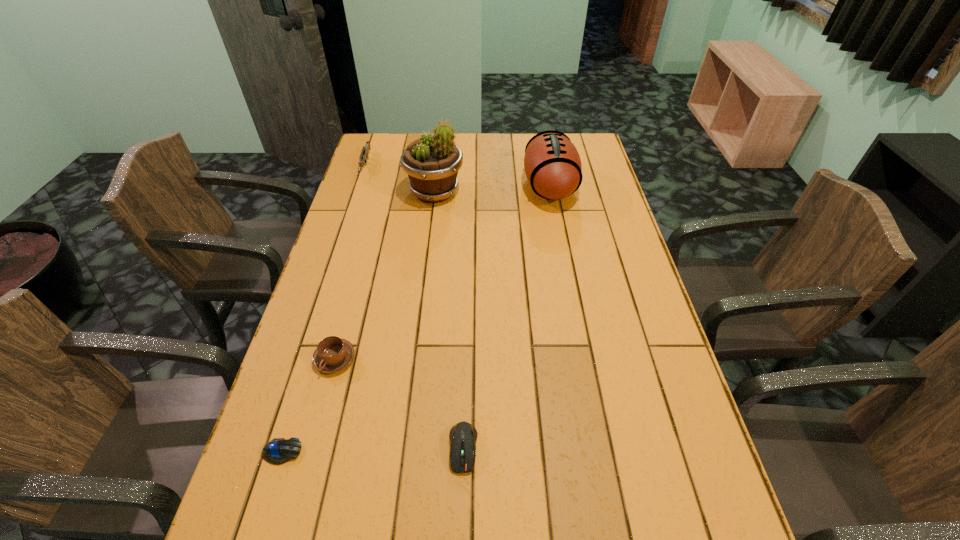
The image size is (960, 540). Find the location of `vacant space that's between the shorter computer mouse and the fourth shortest object`. vacant space that's between the shorter computer mouse and the fourth shortest object is located at coordinates (324, 309).

At what (x,y) coordinates should I click in order to perform the action: click on free spot between the shortest object and the taller computer mouse. Please return your answer as a coordinate pair (x, y). The width and height of the screenshot is (960, 540). Looking at the image, I should click on [x=372, y=450].

You are a GUI agent. You are given a task and a screenshot of the screen. Output one action in this format:
    pyautogui.click(x=<x>, y=<y>)
    Task: Click on the free spot between the shortest object and the third tallest object
    The image size is (960, 540).
    Given the screenshot: What is the action you would take?
    pyautogui.click(x=324, y=309)

Where is `empty space that is in between the right computer mouse and the gun`? The width and height of the screenshot is (960, 540). empty space that is in between the right computer mouse and the gun is located at coordinates (414, 307).

Image resolution: width=960 pixels, height=540 pixels. I want to click on vacant area between the right computer mouse and the rightmost object, so click(x=506, y=317).

Find the location of a particular element. The image size is (960, 540). vacant area between the right computer mouse and the fourth shortest object is located at coordinates (414, 307).

Identify the location of free point between the gun and the third nearest object. (350, 262).

You are a GUI agent. You are given a task and a screenshot of the screen. Output one action in this format:
    pyautogui.click(x=<x>, y=<y>)
    Task: Click on the vacant area between the fourth tallest object and the rightmost object
    This screenshot has width=960, height=540.
    Given the screenshot: What is the action you would take?
    pyautogui.click(x=443, y=273)

Where is `object identified as the fourth closest to the gun`? The height and width of the screenshot is (540, 960). object identified as the fourth closest to the gun is located at coordinates (279, 450).

The width and height of the screenshot is (960, 540). What are the coordinates of `object that is the third closest one to the second shortest object` in the screenshot? It's located at (552, 164).